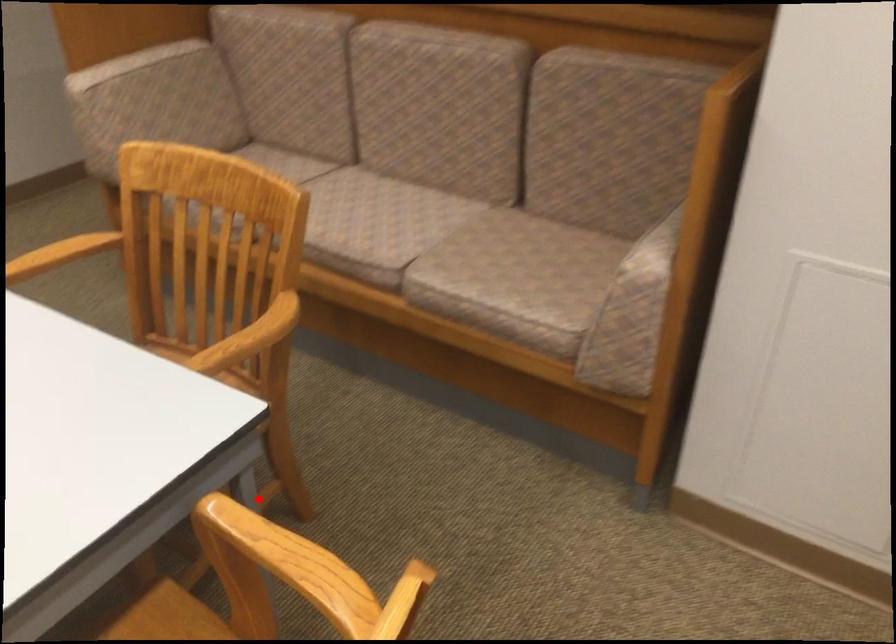
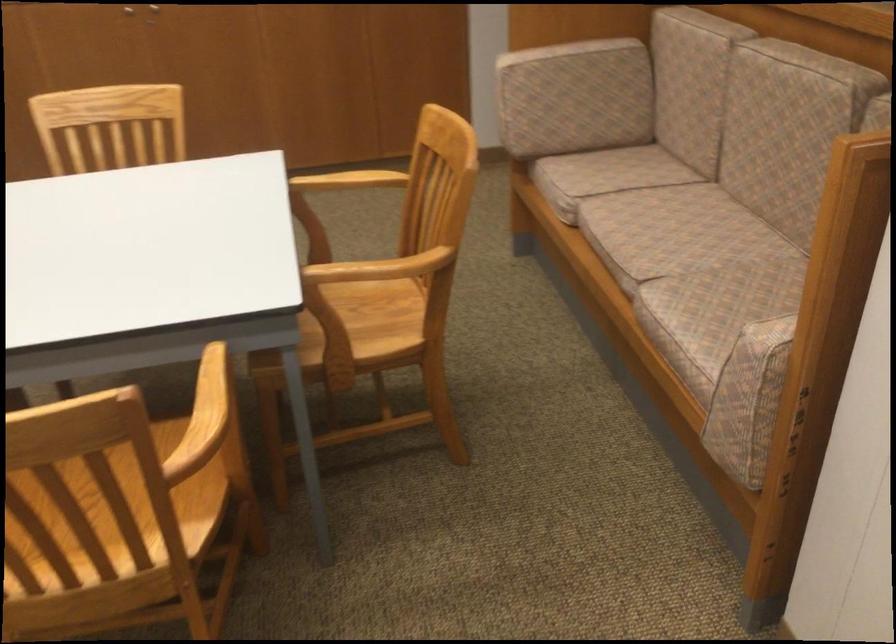
Question: I am providing you with two images of the same scene from different viewpoints. A red point is marked on the first image. Can you still see the location of the red point in image 2?

Choices:
 (A) Yes
 (B) No

Answer: (B)